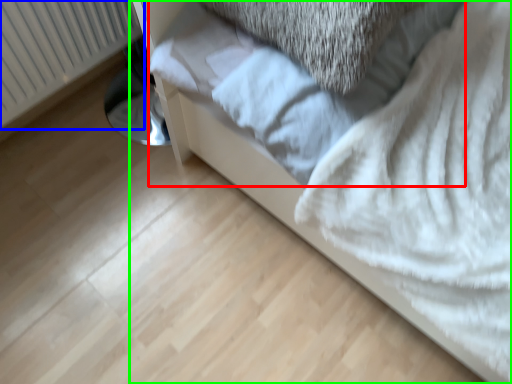
Question: Estimate the real-world distances between objects in this image. Which object is farther from sheet (highlighted by a red box), radiator (highlighted by a blue box) or furniture (highlighted by a green box)?

Choices:
 (A) radiator
 (B) furniture

Answer: (A)